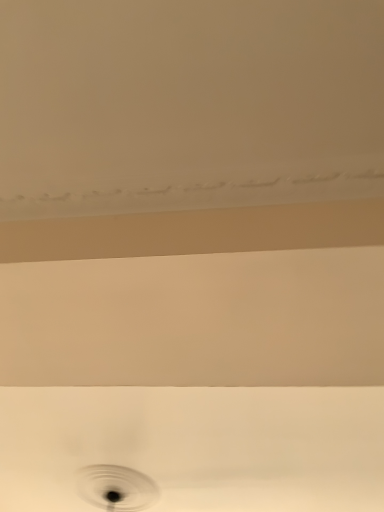
Question: In terms of width, does white glossy sink at center look wider or thinner when compared to black matte hole at center?

Choices:
 (A) wide
 (B) thin

Answer: (A)

Question: From a real-world perspective, is white glossy sink at center above or below black matte hole at center?

Choices:
 (A) below
 (B) above

Answer: (B)

Question: Would you say white glossy sink at center is to the left or to the right of black matte hole at center in the picture?

Choices:
 (A) right
 (B) left

Answer: (A)

Question: Relative to white glossy sink at center, is black matte hole at center in front or behind?

Choices:
 (A) front
 (B) behind

Answer: (B)

Question: Is point (130, 482) positioned closer to the camera than point (251, 419)?

Choices:
 (A) farther
 (B) closer

Answer: (A)

Question: Considering the positions of black matte hole at center and white glossy sink at center in the image, is black matte hole at center taller or shorter than white glossy sink at center?

Choices:
 (A) tall
 (B) short

Answer: (A)

Question: From a real-world perspective, is black matte hole at center positioned above or below white glossy sink at center?

Choices:
 (A) above
 (B) below

Answer: (B)